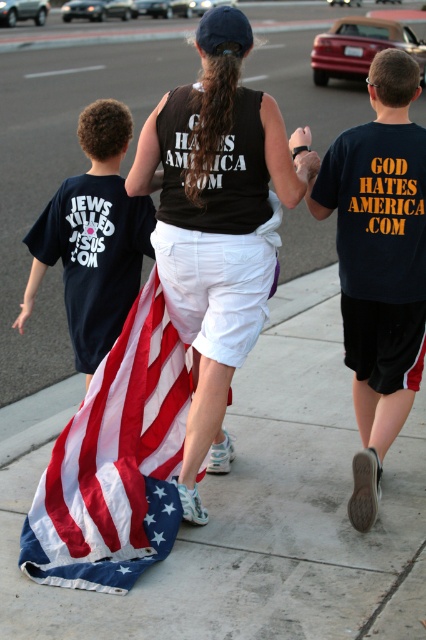
Is matte black tank top at center further to the viewer compared to dark blue t-shirt at left?

No.

Locate an element on the screen. The height and width of the screenshot is (640, 426). matte black tank top at center is located at coordinates (215, 221).

Which of these two, matte black tank top at center or matte black hand at center, stands taller?

matte black tank top at center is taller.

The height and width of the screenshot is (640, 426). Identify the location of matte black tank top at center. (215, 221).

Based on the photo, who is more forward, (245, 269) or (69, 480)?

Point (69, 480) is in front.

Does matte black tank top at center appear on the left side of american flag at center?

Incorrect, matte black tank top at center is not on the left side of american flag at center.

Find the location of a particular element. This screenshot has width=426, height=640. matte black tank top at center is located at coordinates 215,221.